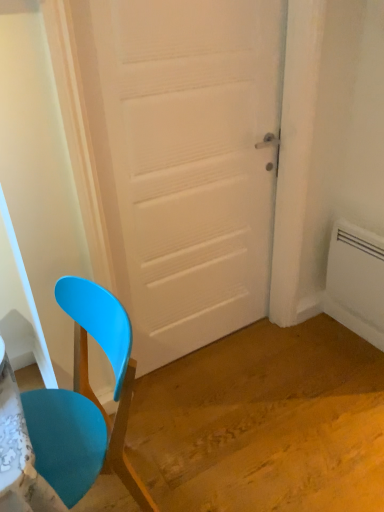
Where is `vacant area to the right of white matte door at center`? vacant area to the right of white matte door at center is located at coordinates (298, 370).